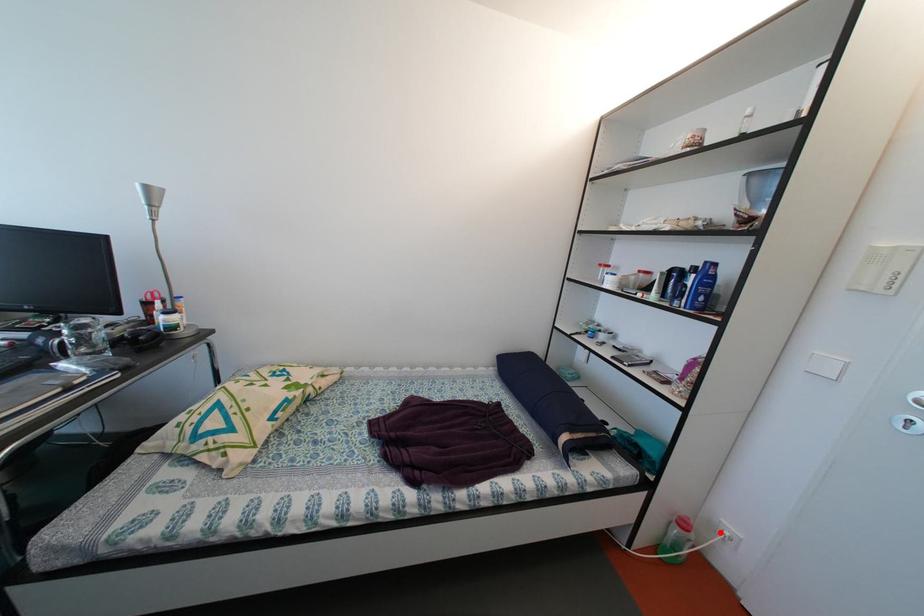
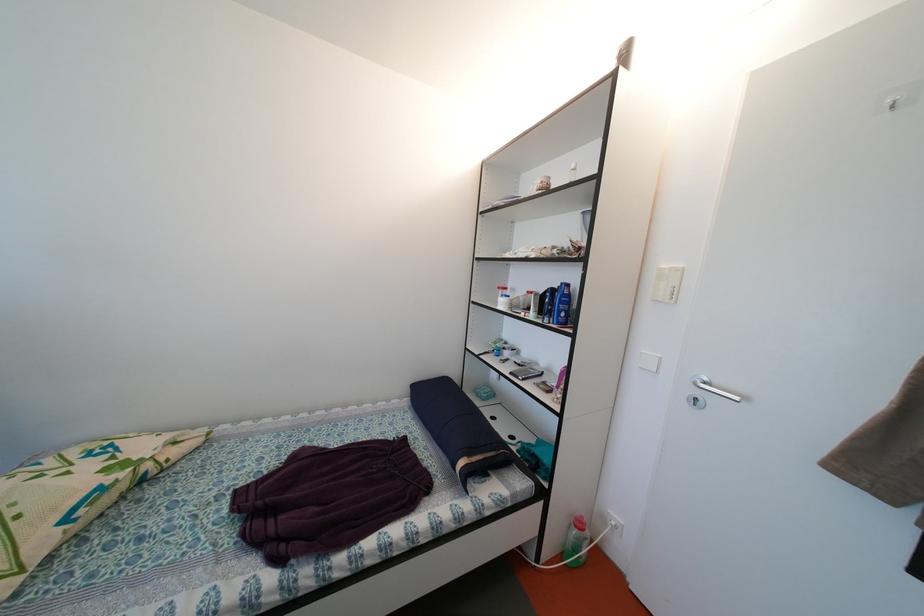
Where in the second image is the point corresponding to the highlighted location from the first image?

(611, 525)